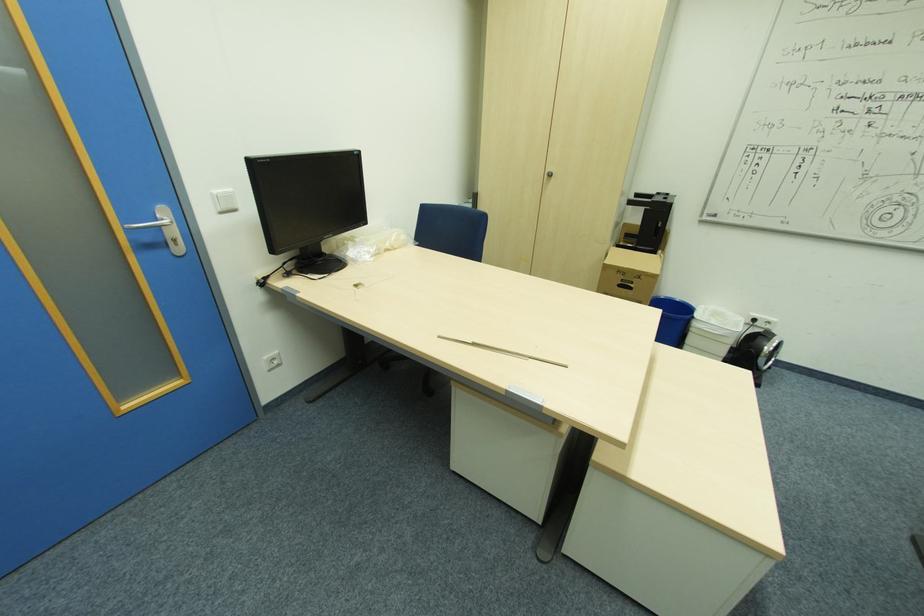
Where is `black fan`? black fan is located at coordinates (755, 352).